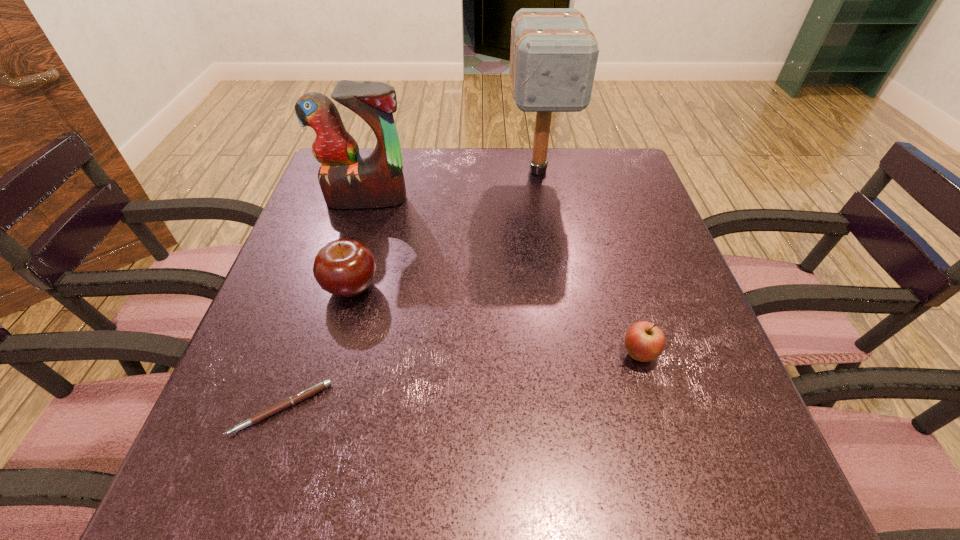
This screenshot has width=960, height=540. I want to click on the tallest object, so click(553, 56).

Locate an element on the screen. This screenshot has width=960, height=540. the second object from right to left is located at coordinates (553, 56).

Find the location of a particular element. parrot is located at coordinates (347, 181).

Where is `the third nearest object`? Image resolution: width=960 pixels, height=540 pixels. the third nearest object is located at coordinates (344, 267).

Locate an element on the screen. The height and width of the screenshot is (540, 960). the farther apple is located at coordinates (344, 267).

At what (x,y) coordinates should I click in order to perform the action: click on the fourth tallest object. Please return your answer as a coordinate pair (x, y). The height and width of the screenshot is (540, 960). Looking at the image, I should click on (644, 341).

Image resolution: width=960 pixels, height=540 pixels. Find the location of `the right apple`. the right apple is located at coordinates (644, 341).

At what (x,y) coordinates should I click in order to perform the action: click on pen. Please return your answer as a coordinate pair (x, y). Looking at the image, I should click on (292, 400).

Image resolution: width=960 pixels, height=540 pixels. I want to click on the shortest object, so click(292, 400).

The height and width of the screenshot is (540, 960). Identify the location of vacant space situated 0.050m on the striking surface of the second object from right to left. (544, 209).